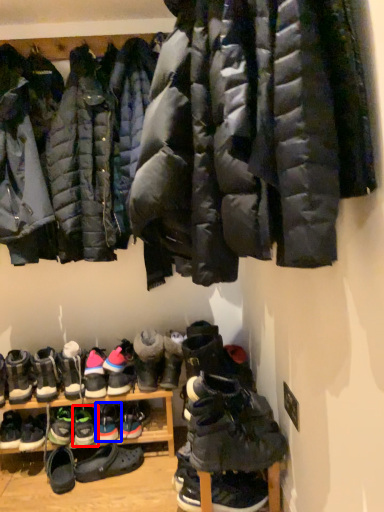
Question: Which object appears closest to the camera in this image, footwear (highlighted by a red box) or footwear (highlighted by a blue box)?

Choices:
 (A) footwear
 (B) footwear

Answer: (A)